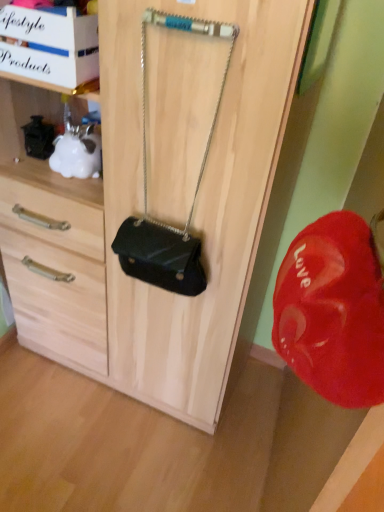
Question: From the image's perspective, is black leather handbag at center above or below matte black purse at center?

Choices:
 (A) below
 (B) above

Answer: (B)

Question: Considering the positions of black leather handbag at center and matte black purse at center in the image, is black leather handbag at center bigger or smaller than matte black purse at center?

Choices:
 (A) small
 (B) big

Answer: (A)

Question: In the image, is black leather handbag at center on the left side or the right side of matte black purse at center?

Choices:
 (A) left
 (B) right

Answer: (B)

Question: Is matte black purse at center taller or shorter than black leather handbag at center?

Choices:
 (A) tall
 (B) short

Answer: (A)

Question: From the image's perspective, is matte black purse at center located above or below black leather handbag at center?

Choices:
 (A) above
 (B) below

Answer: (B)

Question: Looking at their shapes, would you say matte black purse at center is wider or thinner than black leather handbag at center?

Choices:
 (A) thin
 (B) wide

Answer: (B)

Question: Based on their sizes in the image, would you say matte black purse at center is bigger or smaller than black leather handbag at center?

Choices:
 (A) small
 (B) big

Answer: (B)